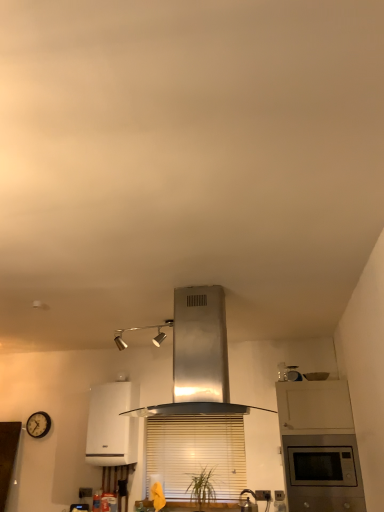
What do you see at coordinates (112, 425) in the screenshot?
I see `white glossy boiler at center, the 1th home appliance in the back-to-front sequence` at bounding box center [112, 425].

I want to click on wooden clock at lower left, so click(x=38, y=424).

The image size is (384, 512). What do you see at coordinates (196, 453) in the screenshot?
I see `wooden blinds at center` at bounding box center [196, 453].

Identify the location of white glossy boiler at center, acting as the 2th home appliance starting from the front. Image resolution: width=384 pixels, height=512 pixels. (112, 425).

Which of these two, satin white cabinet at right or satin silver kettle at lower center, stands taller?

satin white cabinet at right is taller.

Is satin white cabinet at right outside of satin silver kettle at lower center?

Absolutely, satin white cabinet at right is external to satin silver kettle at lower center.

From a real-world perspective, is satin white cabinet at right positioned under satin silver kettle at lower center based on gravity?

No, from a real-world perspective, satin white cabinet at right is not beneath satin silver kettle at lower center.

In terms of width, does satin white cabinet at right look wider or thinner when compared to satin silver kettle at lower center?

Considering their sizes, satin white cabinet at right looks broader than satin silver kettle at lower center.

From the image's perspective, is satin silver kettle at lower center positioned above or below stainless steel range hood at center, which is counted as the first home appliance, starting from the front?

satin silver kettle at lower center is below stainless steel range hood at center, which is counted as the first home appliance, starting from the front.

Is point (241, 503) positioned behind point (202, 303)?

That is True.

In the image, is satin silver kettle at lower center positioned in front of or behind stainless steel range hood at center, the second home appliance positioned from the back?

Clearly, satin silver kettle at lower center is behind stainless steel range hood at center, the second home appliance positioned from the back.

Is satin silver kettle at lower center in contact with stainless steel range hood at center, which is counted as the first home appliance, starting from the front?

satin silver kettle at lower center and stainless steel range hood at center, which is counted as the first home appliance, starting from the front, are not in contact.

In the image, is satin white cabinet at right on the left side or the right side of white glossy boiler at center, acting as the 2th home appliance starting from the front?

satin white cabinet at right is positioned on white glossy boiler at center, acting as the 2th home appliance starting from the front,'s right side.

Is satin white cabinet at right positioned with its back to white glossy boiler at center, placed as the second home appliance when sorted from top to bottom?

satin white cabinet at right is not turned away from white glossy boiler at center, placed as the second home appliance when sorted from top to bottom.

From a real-world perspective, which object stands above the other?

white glossy boiler at center, the 1th home appliance in the back-to-front sequence, from a real-world perspective.

Based on the photo, is satin white cabinet at right wider or thinner than white glossy boiler at center, the 1th home appliance in the back-to-front sequence?

Considering their sizes, satin white cabinet at right looks broader than white glossy boiler at center, the 1th home appliance in the back-to-front sequence.

Choose the correct answer: Is wooden clock at lower left inside wooden blinds at center or outside it?

wooden clock at lower left exists outside the volume of wooden blinds at center.

From a real-world perspective, is wooden clock at lower left over wooden blinds at center?

Yes, from a real-world perspective, wooden clock at lower left is above wooden blinds at center.

Is wooden clock at lower left thinner than wooden blinds at center?

In fact, wooden clock at lower left might be wider than wooden blinds at center.

From the image's perspective, which object appears higher, wooden clock at lower left or stainless steel range hood at center, which is counted as the first home appliance, starting from the front?

stainless steel range hood at center, which is counted as the first home appliance, starting from the front.

How many degrees apart are the facing directions of wooden clock at lower left and stainless steel range hood at center, which ranks as the 2th home appliance in left-to-right order?

The facing directions of wooden clock at lower left and stainless steel range hood at center, which ranks as the 2th home appliance in left-to-right order, are 1.47 degrees apart.

Between wooden clock at lower left and stainless steel range hood at center, which appears as the first home appliance when viewed from the top, which one appears on the right side from the viewer's perspective?

stainless steel range hood at center, which appears as the first home appliance when viewed from the top, is more to the right.

From a real-world perspective, who is located higher, stainless steel range hood at center, acting as the first home appliance starting from the right, or satin silver microwave at upper right?

satin silver microwave at upper right.

From the image's perspective, would you say stainless steel range hood at center, which appears as the first home appliance when viewed from the top, is shown under satin silver microwave at upper right?

Actually, stainless steel range hood at center, which appears as the first home appliance when viewed from the top, appears above satin silver microwave at upper right in the image.

Is point (193, 287) closer or farther from the camera than point (288, 372)?

Point (193, 287) appears to be closer to the viewer than point (288, 372).

I want to click on cabinetry that is above the white glossy boiler at center, the first home appliance in the bottom-to-top sequence (from the image's perspective), so click(x=319, y=447).

Can we say white glossy boiler at center, the 1th home appliance when ordered from left to right, lies outside satin white cabinet at right?

white glossy boiler at center, the 1th home appliance when ordered from left to right, lies outside satin white cabinet at right's area.

From the image's perspective, is white glossy boiler at center, acting as the 2th home appliance starting from the front, below satin white cabinet at right?

Yes, from the image's perspective, white glossy boiler at center, acting as the 2th home appliance starting from the front, is below satin white cabinet at right.

In the image, is white glossy boiler at center, which ranks as the second home appliance in right-to-left order, positioned in front of or behind satin white cabinet at right?

white glossy boiler at center, which ranks as the second home appliance in right-to-left order, is behind satin white cabinet at right.

This screenshot has width=384, height=512. What are the coordinates of `cabinetry to the right of satin silver kettle at lower center` in the screenshot? It's located at (319, 447).

This screenshot has width=384, height=512. Find the location of `kitchen appliance below the stainless steel range hood at center, which appears as the first home appliance when viewed from the top (from the image's perspective)`. kitchen appliance below the stainless steel range hood at center, which appears as the first home appliance when viewed from the top (from the image's perspective) is located at coordinates 248,502.

Estimate the real-world distances between objects in this image. Which object is closer to satin white cabinet at right, satin silver kettle at lower center or satin silver microwave at upper right?

satin silver microwave at upper right is positioned closer to the anchor satin white cabinet at right.

When comparing their distances from satin silver microwave at upper right, does wooden clock at lower left or wooden blinds at center seem closer?

Based on the image, wooden blinds at center appears to be nearer to satin silver microwave at upper right.

From the image, which object appears to be nearer to satin white cabinet at right, wooden clock at lower left or white glossy boiler at center, placed as the second home appliance when sorted from top to bottom?

Based on the image, white glossy boiler at center, placed as the second home appliance when sorted from top to bottom, appears to be nearer to satin white cabinet at right.

Which object lies further to the anchor point wooden clock at lower left, white glossy boiler at center, placed as the second home appliance when sorted from top to bottom, or satin white cabinet at right?

The object further to wooden clock at lower left is satin white cabinet at right.

Considering their positions, is satin silver microwave at upper right positioned further to wooden clock at lower left than satin silver kettle at lower center?

Among the two, satin silver microwave at upper right is located further to wooden clock at lower left.

Estimate the real-world distances between objects in this image. Which object is further from satin white cabinet at right, stainless steel range hood at center, the second home appliance in the bottom-to-top sequence, or white glossy boiler at center, the first home appliance in the bottom-to-top sequence?

The object further to satin white cabinet at right is white glossy boiler at center, the first home appliance in the bottom-to-top sequence.

Based on their spatial positions, is wooden blinds at center or stainless steel range hood at center, which appears as the first home appliance when viewed from the top, closer to satin white cabinet at right?

Among the two, wooden blinds at center is located nearer to satin white cabinet at right.

Considering their positions, is wooden clock at lower left positioned further to satin silver kettle at lower center than white glossy boiler at center, the 1th home appliance in the back-to-front sequence?

Based on the image, wooden clock at lower left appears to be further to satin silver kettle at lower center.

This screenshot has height=512, width=384. Find the location of `home appliance between stainless steel range hood at center, which ranks as the 2th home appliance in left-to-right order, and wooden blinds at center from front to back`. home appliance between stainless steel range hood at center, which ranks as the 2th home appliance in left-to-right order, and wooden blinds at center from front to back is located at coordinates (112, 425).

Where is `kitchen appliance positioned between stainless steel range hood at center, which ranks as the 2th home appliance in left-to-right order, and wooden blinds at center from near to far`? Image resolution: width=384 pixels, height=512 pixels. kitchen appliance positioned between stainless steel range hood at center, which ranks as the 2th home appliance in left-to-right order, and wooden blinds at center from near to far is located at coordinates point(248,502).

Image resolution: width=384 pixels, height=512 pixels. In order to click on kitchen appliance positioned between stainless steel range hood at center, the second home appliance positioned from the back, and white glossy boiler at center, the 1th home appliance when ordered from left to right, from near to far in this screenshot , I will do `click(248, 502)`.

The width and height of the screenshot is (384, 512). Find the location of `appliance between white glossy boiler at center, which ranks as the second home appliance in right-to-left order, and satin white cabinet at right, in the horizontal direction`. appliance between white glossy boiler at center, which ranks as the second home appliance in right-to-left order, and satin white cabinet at right, in the horizontal direction is located at coordinates (293, 373).